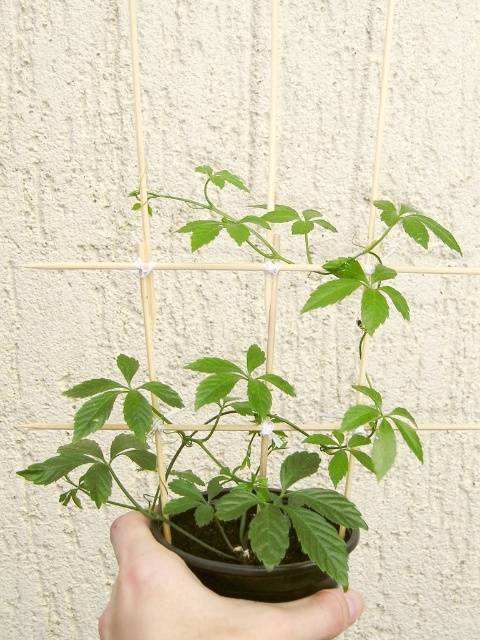
Question: Where is green matte plant at center located in relation to black matte hand at center in the image?

Choices:
 (A) right
 (B) left

Answer: (A)

Question: Among these objects, which one is nearest to the camera?

Choices:
 (A) black matte hand at center
 (B) green matte plant at center

Answer: (A)

Question: Can you confirm if green matte plant at center is thinner than black matte hand at center?

Choices:
 (A) yes
 (B) no

Answer: (B)

Question: Which point appears closest to the camera in this image?

Choices:
 (A) (264, 618)
 (B) (382, 464)

Answer: (A)

Question: Does green matte plant at center appear under black matte hand at center?

Choices:
 (A) no
 (B) yes

Answer: (A)